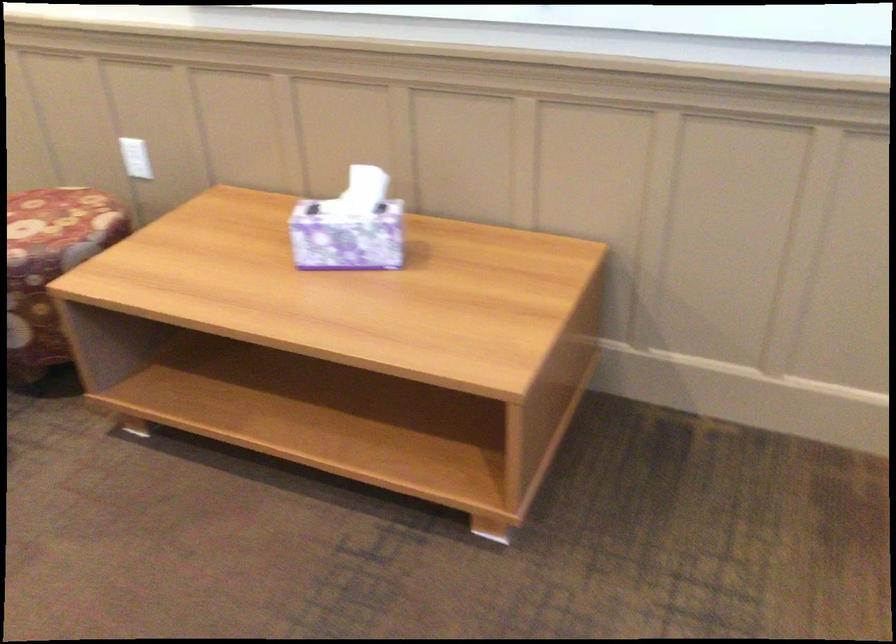
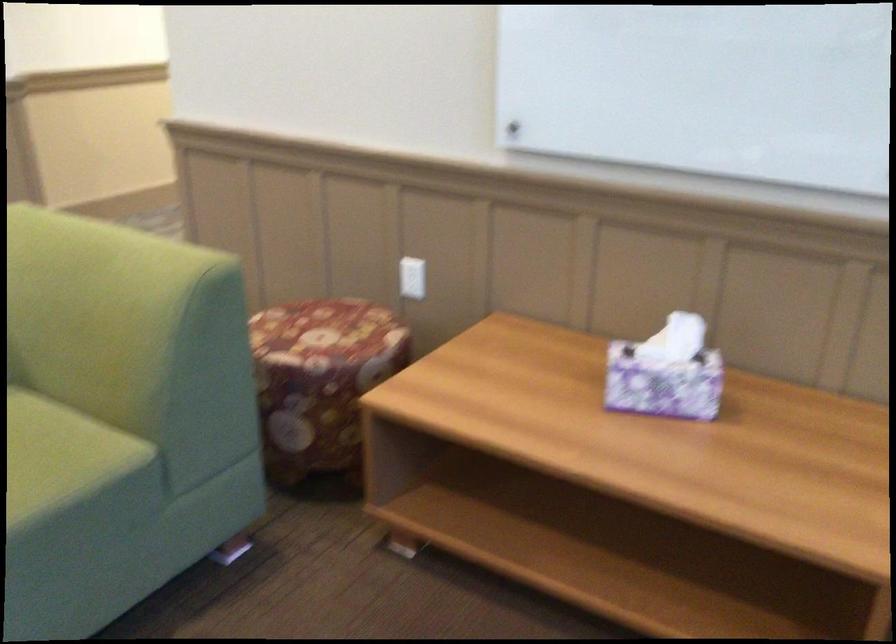
Question: The images are taken continuously from a first-person perspective. In which direction is your viewpoint rotating?

Choices:
 (A) Left
 (B) Right
 (C) Up
 (D) Down

Answer: (C)